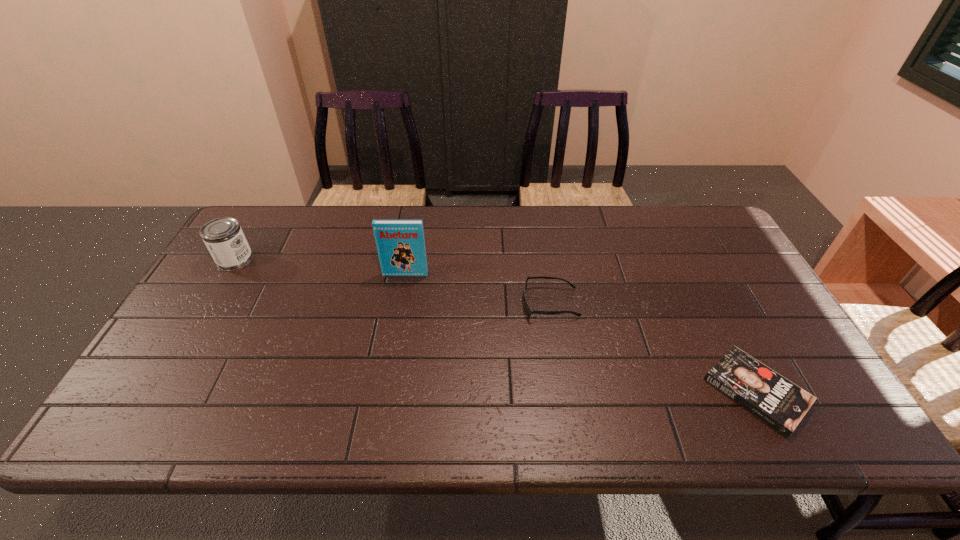
This screenshot has height=540, width=960. In order to click on the tallest object in this screenshot , I will do `click(401, 248)`.

Locate an element on the screen. the farther book is located at coordinates (401, 248).

Locate an element on the screen. The image size is (960, 540). the farthest object is located at coordinates (224, 238).

This screenshot has width=960, height=540. I want to click on the third shortest object, so click(x=224, y=238).

You are a GUI agent. You are given a task and a screenshot of the screen. Output one action in this format:
    pyautogui.click(x=<x>, y=<y>)
    Task: Click on the sunglasses
    The image size is (960, 540).
    Given the screenshot: What is the action you would take?
    pyautogui.click(x=529, y=311)

Find the location of a particular element. The image size is (960, 540). the third object from left to right is located at coordinates (x=529, y=311).

This screenshot has height=540, width=960. Find the location of `the shortest object`. the shortest object is located at coordinates (781, 404).

Identify the location of the right book. (781, 404).

Where is `free location located on the front cover of the third nearest object`? The height and width of the screenshot is (540, 960). free location located on the front cover of the third nearest object is located at coordinates (398, 312).

Identify the location of vacant area located 0.390m on the front of the leftmost object. (160, 385).